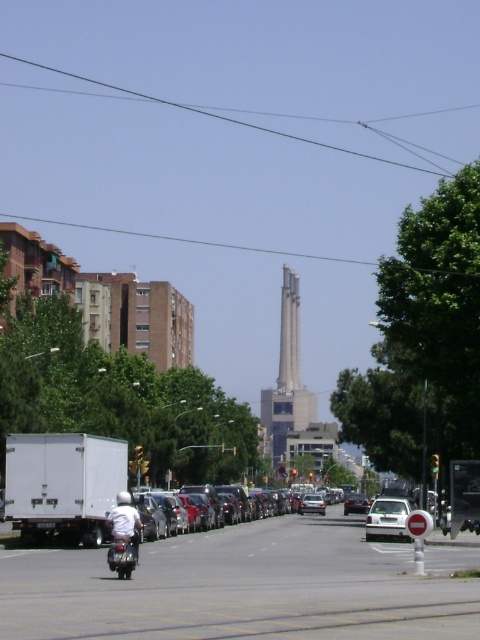
You are a drone operator trying to fly a drone from the silver metallic sedan at center to the concrete tower at center. Based on the scene, can you determine if the drone can ascend vertically from the sedan to reach the tower without moving horizontally?

The concrete tower at center is above the silver metallic sedan at center, so yes, the drone can ascend vertically from the silver metallic sedan at center to reach the concrete tower at center as it is positioned directly above.

You are a drone operator trying to capture a photo of the gray concrete tower at center and the white matte car at center. From your current position, which object should you adjust your camera to look upwards to capture?

To capture the gray concrete tower at center, you should adjust your camera to look upwards since it is positioned above the white matte car at center.